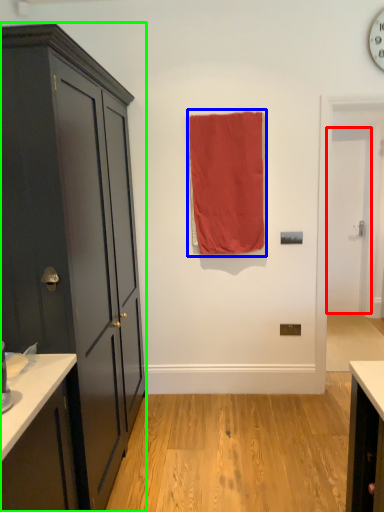
Question: Considering the real-world distances, which object is closest to door (highlighted by a red box)? curtain (highlighted by a blue box) or cabinetry (highlighted by a green box).

Choices:
 (A) curtain
 (B) cabinetry

Answer: (A)